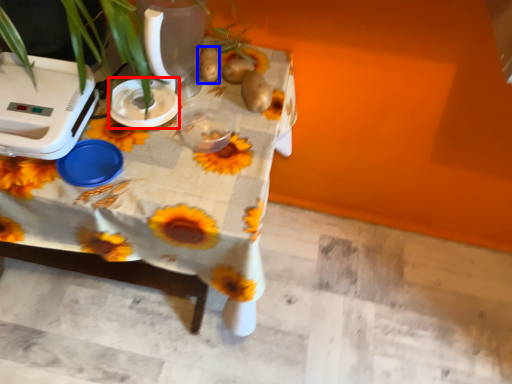
Question: Which of the following is the farthest to the observer, appliance (highlighted by a red box) or potato (highlighted by a blue box)?

Choices:
 (A) appliance
 (B) potato

Answer: (B)